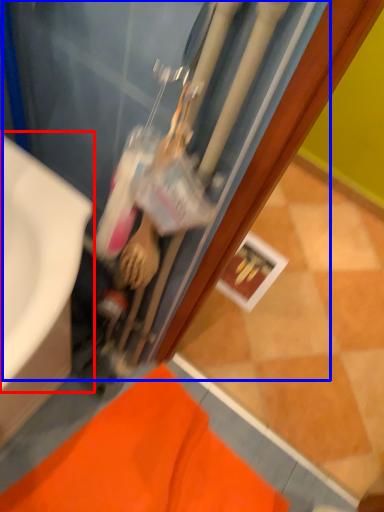
Question: Which object appears closest to the camera in this image, sink (highlighted by a red box) or water heater (highlighted by a blue box)?

Choices:
 (A) sink
 (B) water heater

Answer: (B)